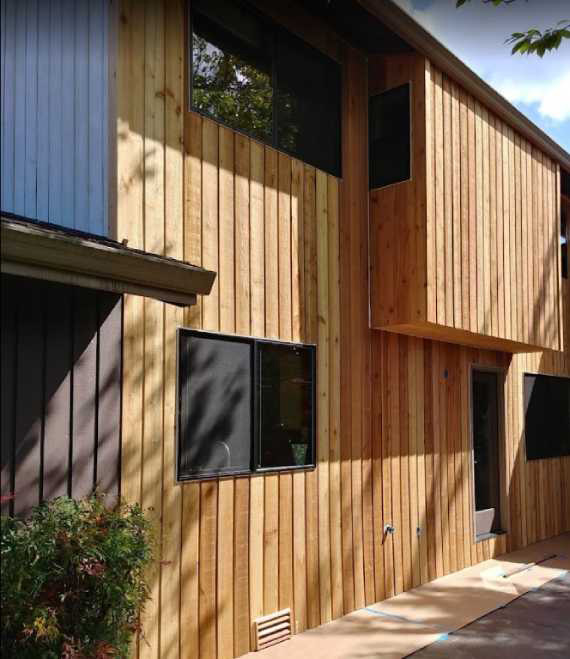
Where is `space between vents`? space between vents is located at coordinates (268, 635).